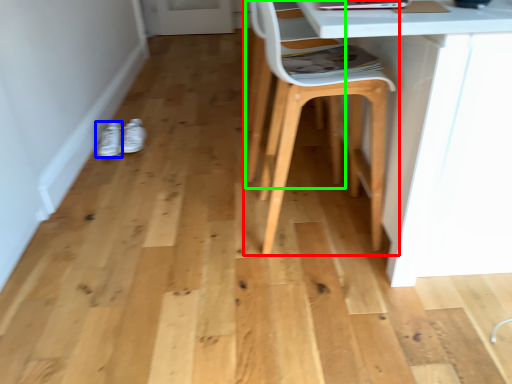
Question: Considering the real-world distances, which object is closest to chair (highlighted by a red box)? footwear (highlighted by a blue box) or swivel chair (highlighted by a green box).

Choices:
 (A) footwear
 (B) swivel chair

Answer: (B)